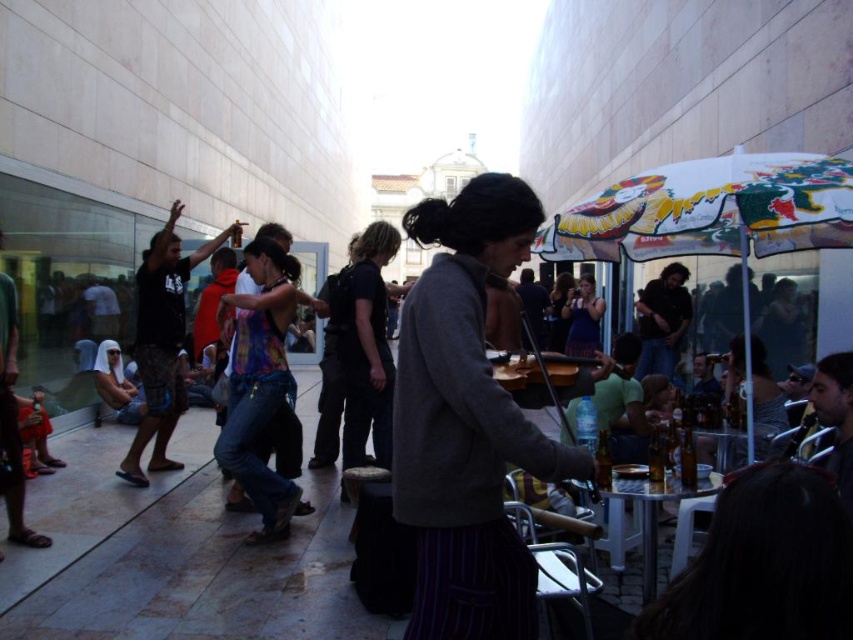
Question: Considering the real-world distances, which object is farthest from the gray woolen sweater at center?

Choices:
 (A) wooden violin at center
 (B) printed fabric umbrella at center

Answer: (B)

Question: Does gray woolen sweater at center have a larger size compared to printed fabric umbrella at center?

Choices:
 (A) no
 (B) yes

Answer: (A)

Question: Which point is closer to the camera?

Choices:
 (A) (505, 378)
 (B) (477, 493)
 (C) (138, 410)

Answer: (B)

Question: Which object is farther from the camera taking this photo?

Choices:
 (A) printed fabric umbrella at center
 (B) wooden violin at center
 (C) gray woolen sweater at center
 (D) white cotton towel at lower left

Answer: (D)

Question: Can you confirm if gray woolen sweater at center is smaller than printed fabric umbrella at center?

Choices:
 (A) yes
 (B) no

Answer: (A)

Question: Can you confirm if wooden violin at center is positioned below white cotton towel at lower left?

Choices:
 (A) yes
 (B) no

Answer: (B)